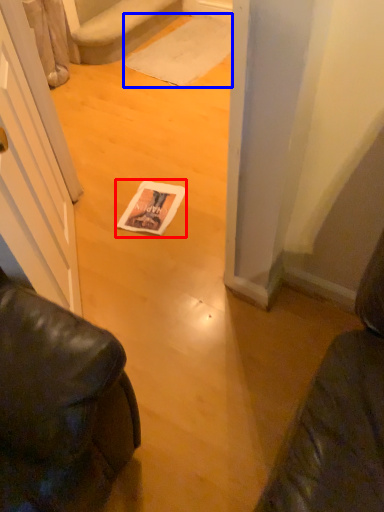
Question: Which point is further to the camera, magazine (highlighted by a red box) or doormat (highlighted by a blue box)?

Choices:
 (A) magazine
 (B) doormat

Answer: (B)